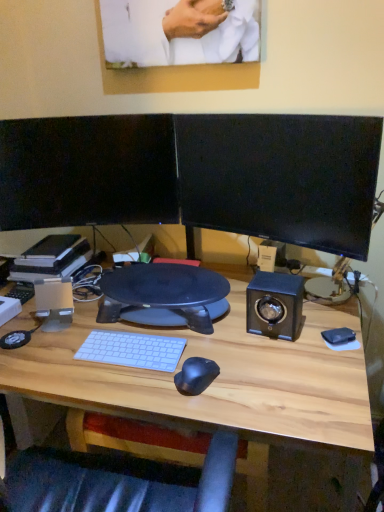
What do you see at coordinates (216, 381) in the screenshot? I see `wooden desk at center` at bounding box center [216, 381].

Where is `wooden desk at center`? This screenshot has width=384, height=512. wooden desk at center is located at coordinates (216, 381).

At what (x,y) coordinates should I click in order to perform the action: click on wooden desk at center. Please return your answer as a coordinate pair (x, y). This screenshot has width=384, height=512. Looking at the image, I should click on (216, 381).